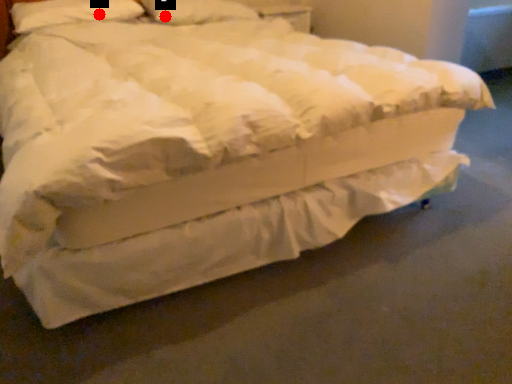
Question: Two points are circled on the image, labeled by A and B beside each circle. Among these points, which one is farthest from the camera?

Choices:
 (A) A is further
 (B) B is further

Answer: (B)